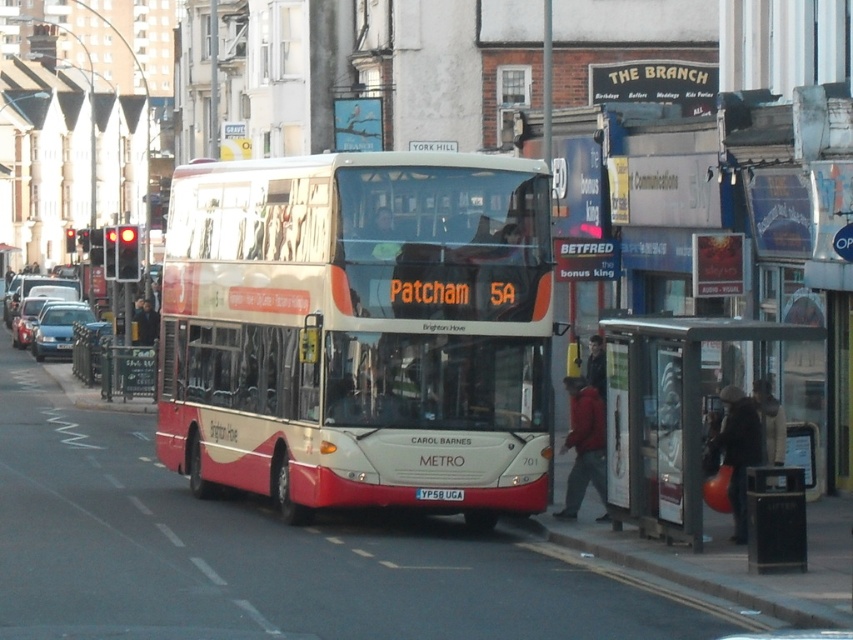
You are standing at the point marked with coordinates point (358, 330) in the image. What object are you directly facing?

You are directly facing the white glossy bus at center.

You are a pedestrian standing on the sidewalk and want to board the white glossy bus at center. The metallic bus stop at lower right has a schedule board. Which direction should you walk to reach the bus stop first before catching the bus?

You should walk towards the metallic bus stop at lower right first because the white glossy bus at center is to the left of it, meaning the bus stop is on the right side relative to the bus. Since you want to check the schedule before boarding, head to the bus stop on the right.